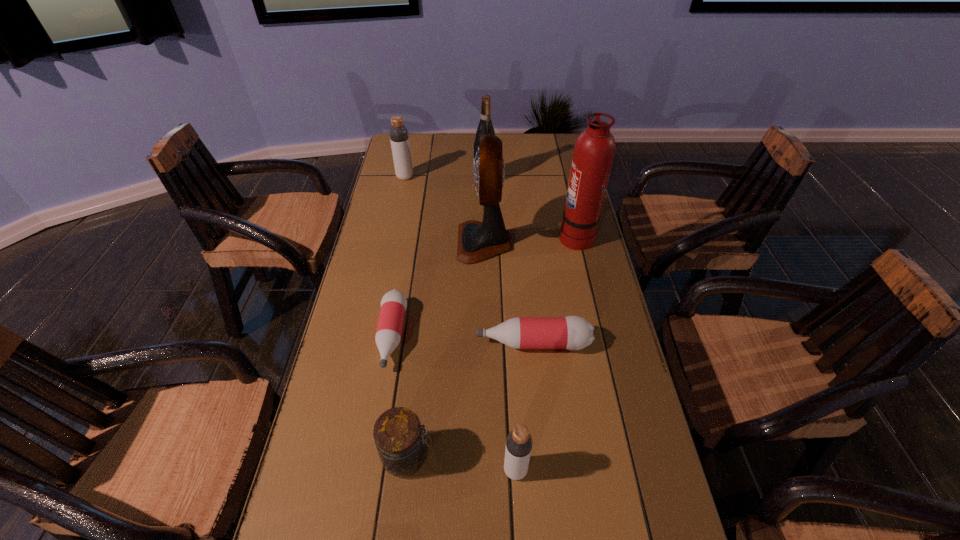
Identify the location of the second closest object relative to the tallest bottle. The height and width of the screenshot is (540, 960). (477, 241).

The image size is (960, 540). I want to click on bottle identified as the closest to the fire extinguisher, so click(x=572, y=332).

Where is `the third closest bottle to the third shortest bottle`? the third closest bottle to the third shortest bottle is located at coordinates (399, 137).

Select which pink bottle appears as the closest to the fourth tallest object. Please provide its 2D coordinates. Your answer should be formatted as a tuple, i.e. [(x, y)], where the tuple contains the x and y coordinates of a point satisfying the conditions above.

[(393, 304)]

Image resolution: width=960 pixels, height=540 pixels. I want to click on free space in the image that satisfies the following two spatial constraints: 1. on the lid of the jar; 2. on the right side of the smaller gray bottle, so click(406, 470).

The width and height of the screenshot is (960, 540). Identify the location of vacant point that satisfies the following two spatial constraints: 1. on the lid of the nearer gray bottle; 2. on the left side of the third shortest object. (406, 470).